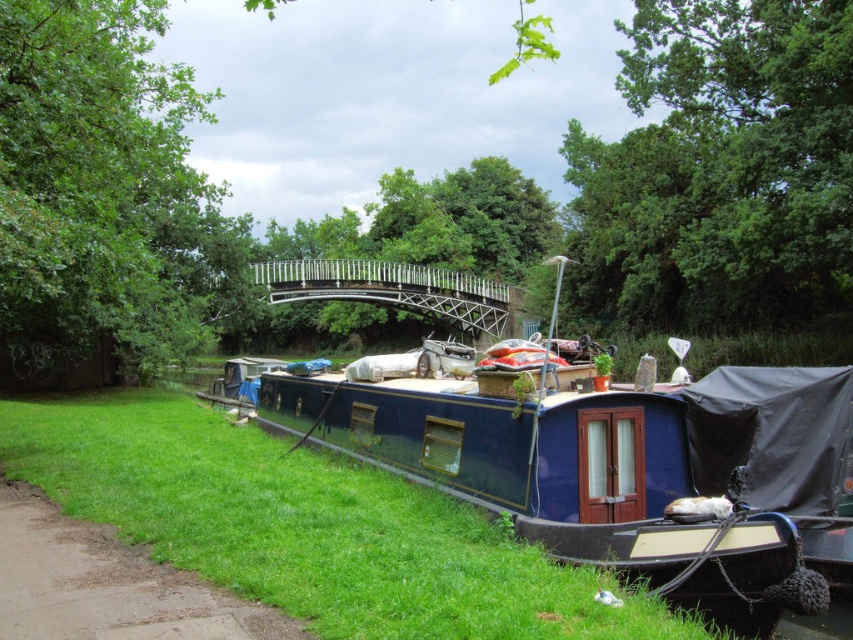
Question: Can you confirm if green grass at lower left is smaller than metallic silver bridge at center?

Choices:
 (A) yes
 (B) no

Answer: (A)

Question: Is blue glossy boat at center above green grass at lower left?

Choices:
 (A) no
 (B) yes

Answer: (B)

Question: Which object is the closest to the blue glossy boat at center?

Choices:
 (A) metallic silver bridge at center
 (B) green grass at lower left

Answer: (A)

Question: Considering the real-world distances, which object is farthest from the blue glossy boat at center?

Choices:
 (A) green grass at lower left
 (B) metallic silver bridge at center

Answer: (A)

Question: In this image, where is blue glossy boat at center located relative to green grass at lower left?

Choices:
 (A) below
 (B) above

Answer: (B)

Question: Which object is farther from the camera taking this photo?

Choices:
 (A) blue glossy boat at center
 (B) green grass at lower left

Answer: (A)